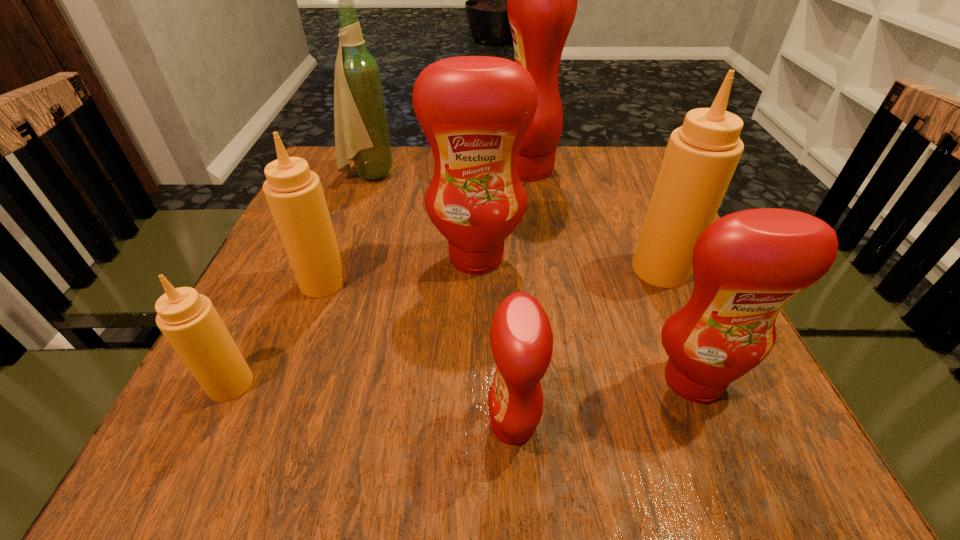
Where is `vacant space at the left edge of the desktop`? The image size is (960, 540). vacant space at the left edge of the desktop is located at coordinates (268, 350).

Where is `vacant region at the right edge`? vacant region at the right edge is located at coordinates (650, 289).

Locate an element on the screen. Image resolution: width=960 pixels, height=540 pixels. vacant region at the near left corner of the desktop is located at coordinates (x=178, y=439).

I want to click on free space at the far right corner, so click(640, 157).

Locate an element on the screen. unoccupied position between the third biggest red condiment and the farthest red condiment is located at coordinates (611, 274).

Identify the location of unoccupied area between the second biggest red condiment and the leftmost condiment. (x=353, y=321).

Locate an element on the screen. vacant space in between the second tan condiment from right to left and the farthest condiment is located at coordinates (425, 226).

Where is `free spot between the tallest condiment and the biggest tan condiment`? The image size is (960, 540). free spot between the tallest condiment and the biggest tan condiment is located at coordinates (594, 219).

Find the location of `vacant space in between the leftmost condiment and the second biggest tan condiment`. vacant space in between the leftmost condiment and the second biggest tan condiment is located at coordinates pyautogui.click(x=276, y=333).

At what (x,y) coordinates should I click in order to perform the action: click on vacant point located between the third nearest red condiment and the leftmost condiment. Please return your answer as a coordinate pair (x, y). Looking at the image, I should click on (353, 321).